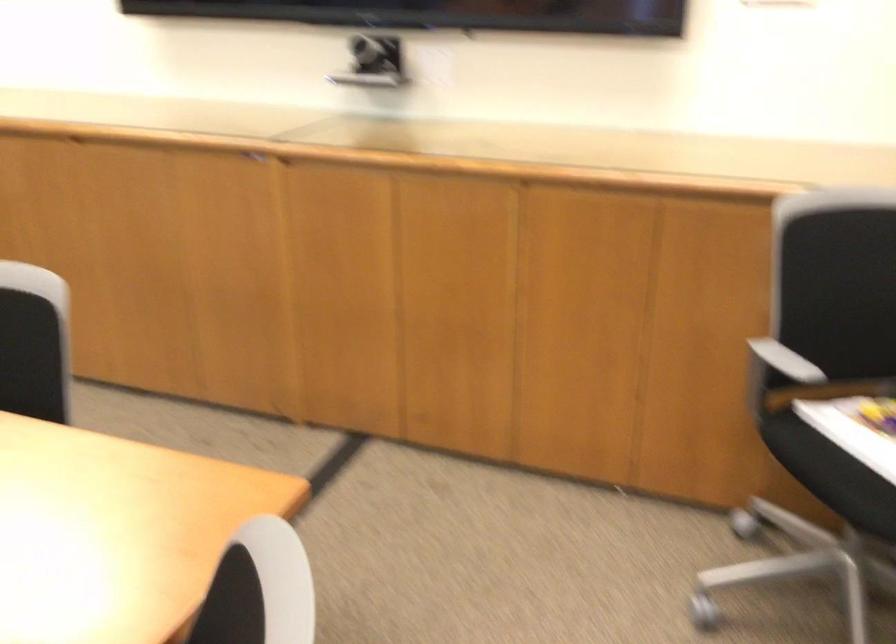
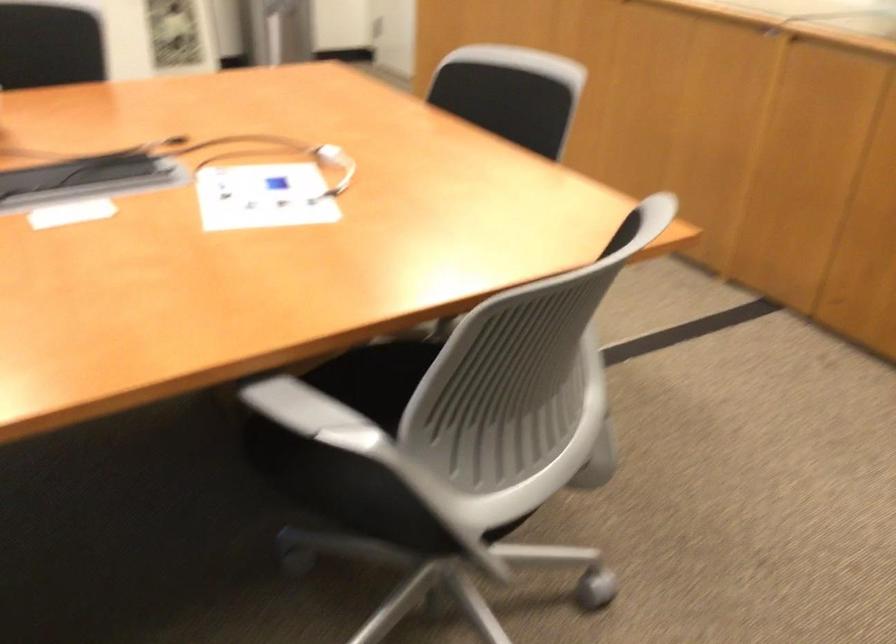
Question: Based on the continuous images, in which direction is the camera rotating? Reply with the corresponding letter.

Choices:
 (A) Left
 (B) Right
 (C) Up
 (D) Down

Answer: (A)